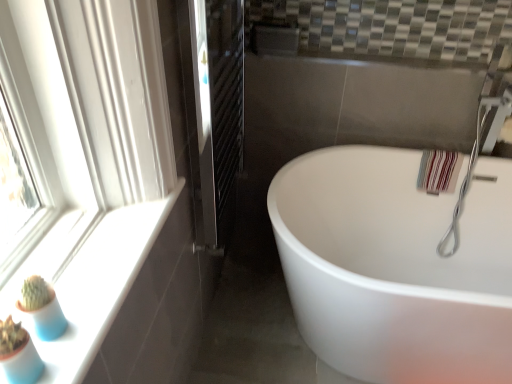
Question: Considering the relative sizes of black metal radiator at center and white glossy window sill at lower left in the image provided, is black metal radiator at center wider than white glossy window sill at lower left?

Choices:
 (A) yes
 (B) no

Answer: (B)

Question: Considering the relative sizes of black metal radiator at center and white glossy window sill at lower left in the image provided, is black metal radiator at center thinner than white glossy window sill at lower left?

Choices:
 (A) no
 (B) yes

Answer: (B)

Question: Is white glossy window sill at lower left a part of black metal radiator at center?

Choices:
 (A) no
 (B) yes

Answer: (A)

Question: Considering the relative sizes of black metal radiator at center and white glossy window sill at lower left in the image provided, is black metal radiator at center shorter than white glossy window sill at lower left?

Choices:
 (A) no
 (B) yes

Answer: (A)

Question: From a real-world perspective, is black metal radiator at center beneath white glossy window sill at lower left?

Choices:
 (A) yes
 (B) no

Answer: (A)

Question: Is black metal radiator at center positioned with its back to white glossy window sill at lower left?

Choices:
 (A) no
 (B) yes

Answer: (A)

Question: Can you confirm if silver metallic faucet at upper right is shorter than white glossy bathtub at center?

Choices:
 (A) yes
 (B) no

Answer: (B)

Question: Does silver metallic faucet at upper right have a smaller size compared to white glossy bathtub at center?

Choices:
 (A) no
 (B) yes

Answer: (B)

Question: From a real-world perspective, is silver metallic faucet at upper right physically above white glossy bathtub at center?

Choices:
 (A) yes
 (B) no

Answer: (A)

Question: Is silver metallic faucet at upper right located outside white glossy bathtub at center?

Choices:
 (A) yes
 (B) no

Answer: (B)

Question: Is silver metallic faucet at upper right not close to white glossy bathtub at center?

Choices:
 (A) yes
 (B) no

Answer: (B)

Question: Does silver metallic faucet at upper right have a greater width compared to white glossy bathtub at center?

Choices:
 (A) no
 (B) yes

Answer: (A)

Question: Would you say white glossy window sill at lower left is part of white glossy bathtub at center's contents?

Choices:
 (A) no
 (B) yes

Answer: (A)